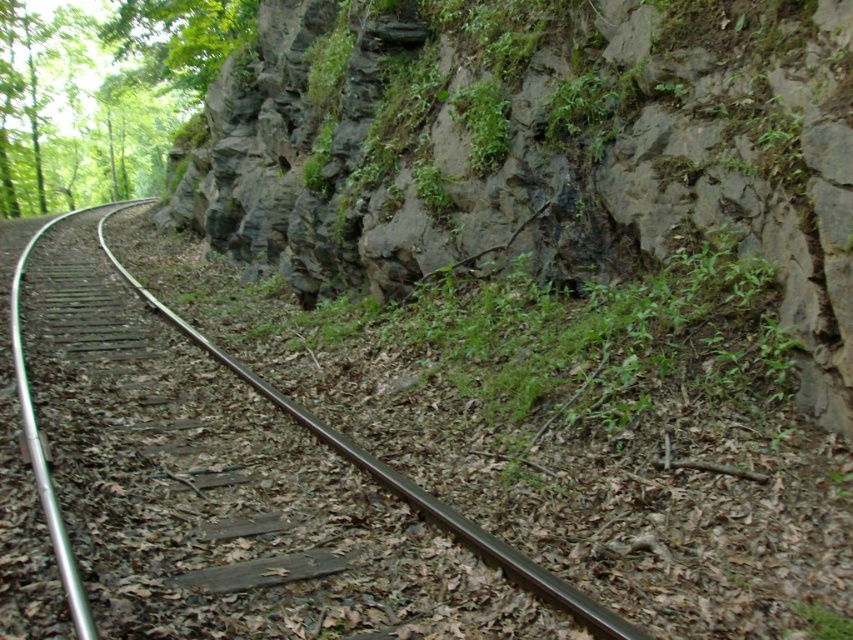
Question: Which is nearer to the rocky cliff at center?

Choices:
 (A) black metal track at left
 (B) green leafy tree at upper left

Answer: (A)

Question: Which of the following is the closest to the observer?

Choices:
 (A) rocky cliff at center
 (B) green leafy tree at upper left

Answer: (A)

Question: Does rocky cliff at center have a lesser width compared to black metal track at left?

Choices:
 (A) no
 (B) yes

Answer: (B)

Question: Is green leafy tree at upper left closer to camera compared to black metal track at left?

Choices:
 (A) no
 (B) yes

Answer: (A)

Question: Is rocky cliff at center closer to the viewer compared to black metal track at left?

Choices:
 (A) yes
 (B) no

Answer: (B)

Question: Which point is farther from the camera taking this photo?

Choices:
 (A) (297, 152)
 (B) (33, 65)

Answer: (B)